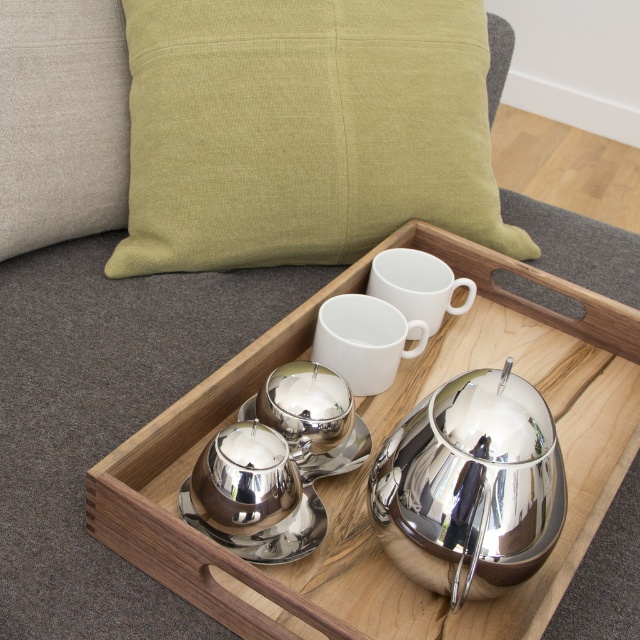
You are setting up a table for a tea party and need to ensure that the white matte cup at center can fit under the polished silver tray at center. Based on the scene, will the cup fit underneath the tray?

The polished silver tray at center has a greater height compared to the white matte cup at center, so the cup can fit underneath the tray as the tray is taller.

You are arranging a tea set on the polished silver tray at center and need to place the green fabric cushion at upper center nearby. Based on the scene, which object is shorter?

The green fabric cushion at upper center is shorter than the polished silver tray at center.

You are a delivery person who needs to place a small package on the tray without disturbing the cushion. Given that the distance between the green fabric cushion at upper center and the polished silver tray at center is 10.97 inches, will the package fit between them?

The distance between the green fabric cushion at upper center and the polished silver tray at center is 10.97 inches. If the package is smaller than this distance, it can fit between them. However, the exact size of the package is not provided, so we cannot confirm for certain.